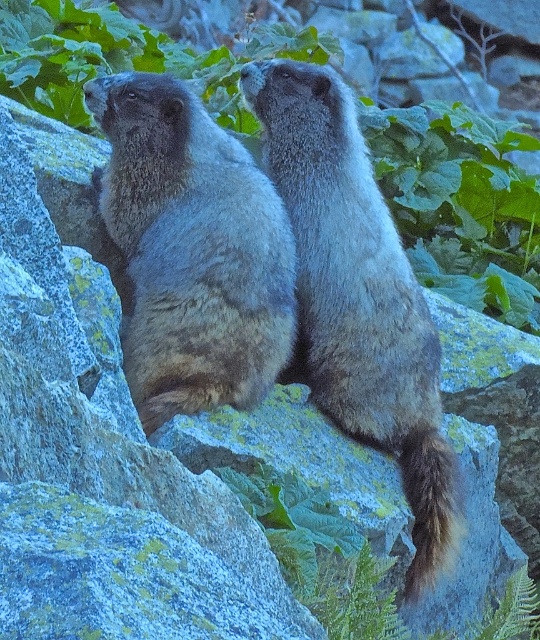
Who is positioned more to the right, fuzzy brownish-gray marmot at center or brown furry tail at right?

brown furry tail at right is more to the right.

Between fuzzy brownish-gray marmot at center and brown furry tail at right, which one is positioned lower?

Positioned lower is brown furry tail at right.

Who is more distant from viewer, (402, 403) or (456, 508)?

Positioned behind is point (402, 403).

You are a GUI agent. You are given a task and a screenshot of the screen. Output one action in this format:
    pyautogui.click(x=<x>, y=<y>)
    Task: Click on the fuzzy brownish-gray marmot at center
    The width and height of the screenshot is (540, 640).
    Given the screenshot: What is the action you would take?
    pyautogui.click(x=357, y=296)

Is fuzzy brown groundhog at center bigger than fuzzy brownish-gray marmot at center?

Incorrect, fuzzy brown groundhog at center is not larger than fuzzy brownish-gray marmot at center.

Who is taller, fuzzy brown groundhog at center or fuzzy brownish-gray marmot at center?

Standing taller between the two is fuzzy brownish-gray marmot at center.

Is point (140, 296) behind point (364, 316)?

No.

Identify the location of fuzzy brown groundhog at center. (192, 250).

Can you confirm if fuzzy brownish-gray marmot at center is taller than green leafy plant at upper center?

Correct, fuzzy brownish-gray marmot at center is much taller as green leafy plant at upper center.

Who is shorter, fuzzy brownish-gray marmot at center or green leafy plant at upper center?

With less height is green leafy plant at upper center.

The height and width of the screenshot is (640, 540). Identify the location of fuzzy brownish-gray marmot at center. (357, 296).

The width and height of the screenshot is (540, 640). In order to click on fuzzy brownish-gray marmot at center in this screenshot , I will do `click(357, 296)`.